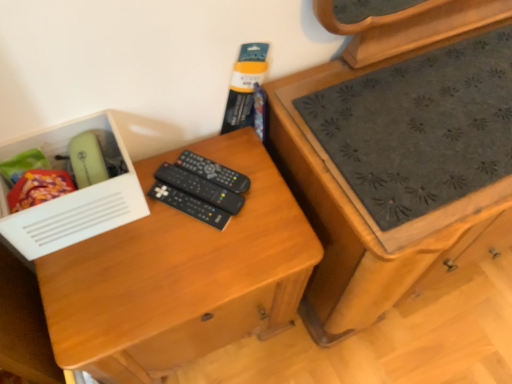
Locate an element on the screen. Image resolution: width=512 pixels, height=384 pixels. vacant space to the right of black plastic remote controls at center, the second remote control positioned from the bottom is located at coordinates (268, 212).